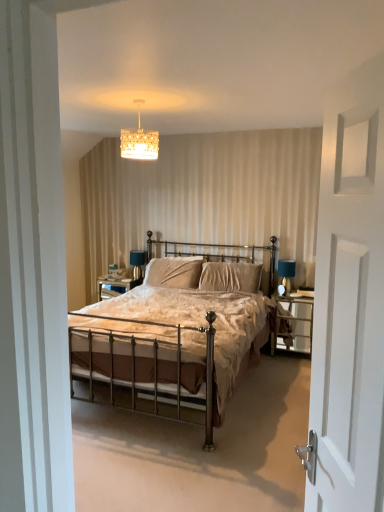
Question: Is white matte screen door at right smaller than gold textured chandelier at upper center?

Choices:
 (A) yes
 (B) no

Answer: (B)

Question: Is white matte screen door at right shorter than gold textured chandelier at upper center?

Choices:
 (A) yes
 (B) no

Answer: (B)

Question: Considering the relative positions of white matte screen door at right and gold textured chandelier at upper center in the image provided, is white matte screen door at right in front of gold textured chandelier at upper center?

Choices:
 (A) yes
 (B) no

Answer: (A)

Question: Is the depth of white matte screen door at right greater than that of gold textured chandelier at upper center?

Choices:
 (A) no
 (B) yes

Answer: (A)

Question: Can you confirm if white matte screen door at right is wider than gold textured chandelier at upper center?

Choices:
 (A) no
 (B) yes

Answer: (A)

Question: Considering the positions of point (243, 263) and point (148, 274), is point (243, 263) closer or farther from the camera than point (148, 274)?

Choices:
 (A) farther
 (B) closer

Answer: (B)

Question: Looking at the image, does velvet beige pillow at center, arranged as the 1th pillow when viewed from the right, seem bigger or smaller compared to velvet beige pillow at center, marked as the 1th pillow in a left-to-right arrangement?

Choices:
 (A) small
 (B) big

Answer: (B)

Question: From a real-world perspective, is velvet beige pillow at center, arranged as the 1th pillow when viewed from the right, positioned above or below velvet beige pillow at center, the 2th pillow in the right-to-left sequence?

Choices:
 (A) above
 (B) below

Answer: (B)

Question: Would you say velvet beige pillow at center, arranged as the 1th pillow when viewed from the right, is to the left or to the right of velvet beige pillow at center, the 2th pillow in the right-to-left sequence, in the picture?

Choices:
 (A) right
 (B) left

Answer: (A)

Question: From a real-world perspective, is bronze metal bed at center positioned above or below gold textured chandelier at upper center?

Choices:
 (A) below
 (B) above

Answer: (A)

Question: In the image, is bronze metal bed at center on the left side or the right side of gold textured chandelier at upper center?

Choices:
 (A) right
 (B) left

Answer: (A)

Question: Looking at their shapes, would you say bronze metal bed at center is wider or thinner than gold textured chandelier at upper center?

Choices:
 (A) wide
 (B) thin

Answer: (A)

Question: Does point (144, 324) appear closer or farther from the camera than point (147, 146)?

Choices:
 (A) closer
 (B) farther

Answer: (B)

Question: From a real-world perspective, relative to bronze metal bed at center, is matte black table lamp at right vertically above or below?

Choices:
 (A) above
 (B) below

Answer: (A)

Question: In the image, is matte black table lamp at right on the left side or the right side of bronze metal bed at center?

Choices:
 (A) right
 (B) left

Answer: (A)